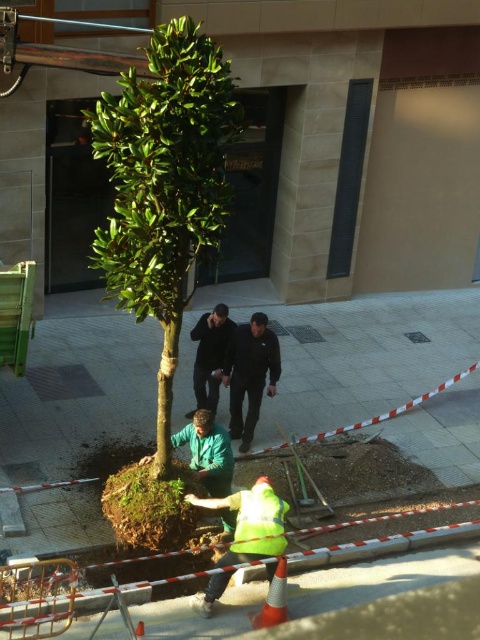
Question: Can you confirm if green leafy tree at center is positioned to the left of high visibility yellow safety vest at lower center?

Choices:
 (A) no
 (B) yes

Answer: (B)

Question: Which object appears closest to the camera in this image?

Choices:
 (A) high visibility yellow safety vest at lower center
 (B) dark gray smooth jacket at center
 (C) green grass at center
 (D) black smooth jacket at center

Answer: (A)

Question: Which point is farther to the camera?

Choices:
 (A) (425, 337)
 (B) (211, 609)

Answer: (A)

Question: Estimate the real-world distances between objects in this image. Which object is farther from the black smooth jacket at center?

Choices:
 (A) dark gray smooth jacket at center
 (B) green grass at center

Answer: (B)

Question: Is green leafy tree at center positioned in front of dark gray smooth jacket at center?

Choices:
 (A) no
 (B) yes

Answer: (B)

Question: Does green leafy tree at center appear on the left side of dark gray smooth jacket at center?

Choices:
 (A) yes
 (B) no

Answer: (A)